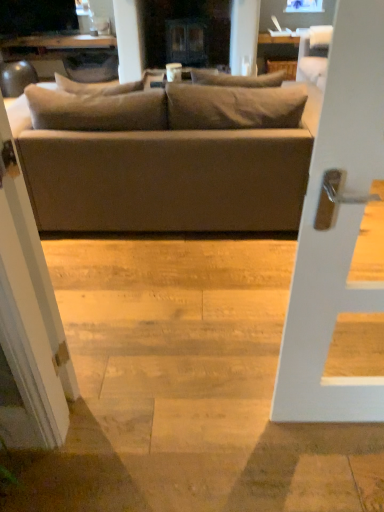
Locate an element on the screen. This screenshot has height=512, width=384. vacant space that's between matte gray couch at center and white glossy screen door at left is located at coordinates (158, 285).